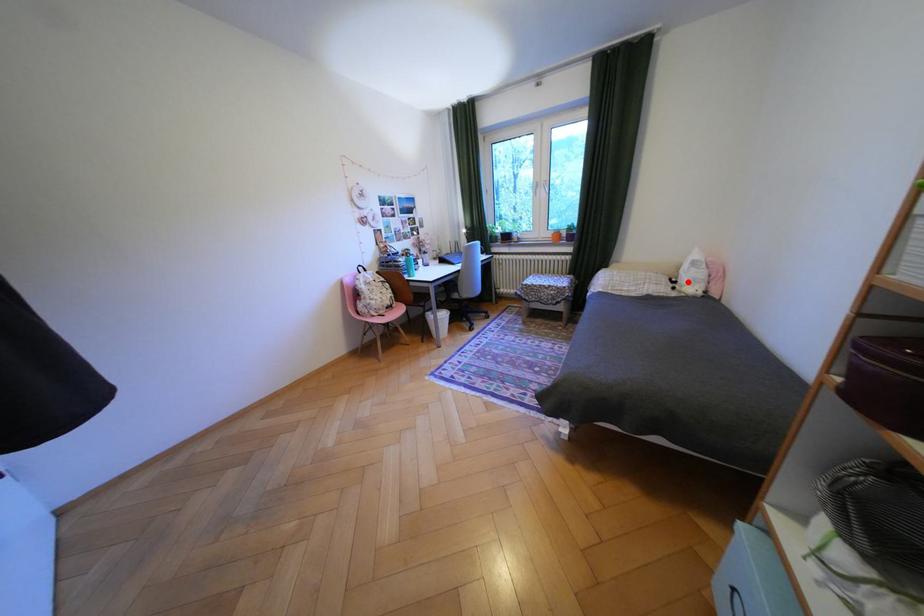
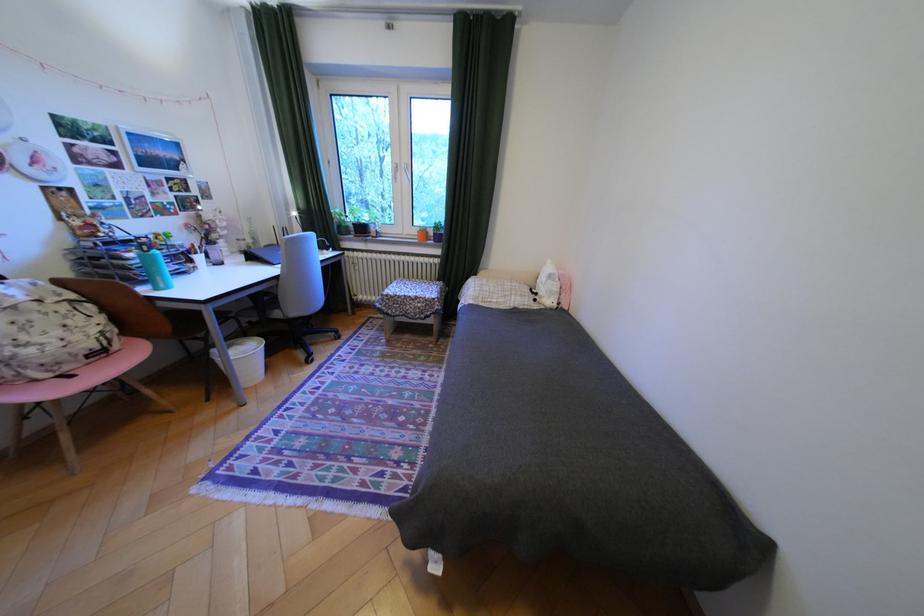
Question: I am providing you with two images of the same scene from different viewpoints. A red point is marked on the first image. Is the red point's position out of view in image 2?

Choices:
 (A) Yes
 (B) No

Answer: (B)